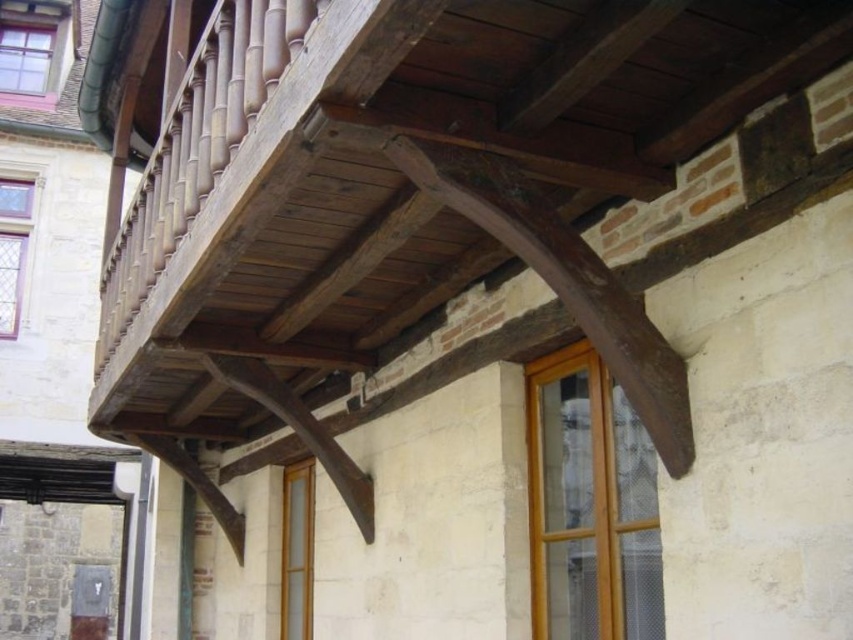
From the picture: You are an architect designing a new building and want to ensure proper ventilation. You have two windows available for placement on the balcony area. The clear glass window at center and the matte pink glass window at upper left. Which window should you choose if you need a larger window for better airflow?

The matte pink glass window at upper left is larger than the clear glass window at center, so it should be chosen for better airflow due to its larger size.

You are an architect designing a new building and want to replicate the balcony design shown in the image. You need to ensure that the clear glass window at center and the clear glass window at upper left are proportionally sized. Which window should be made smaller to match the original design?

The clear glass window at center should be made smaller than the clear glass window at upper left to match the original design, as the clear glass window at center is smaller than clear glass window at upper left in the image.